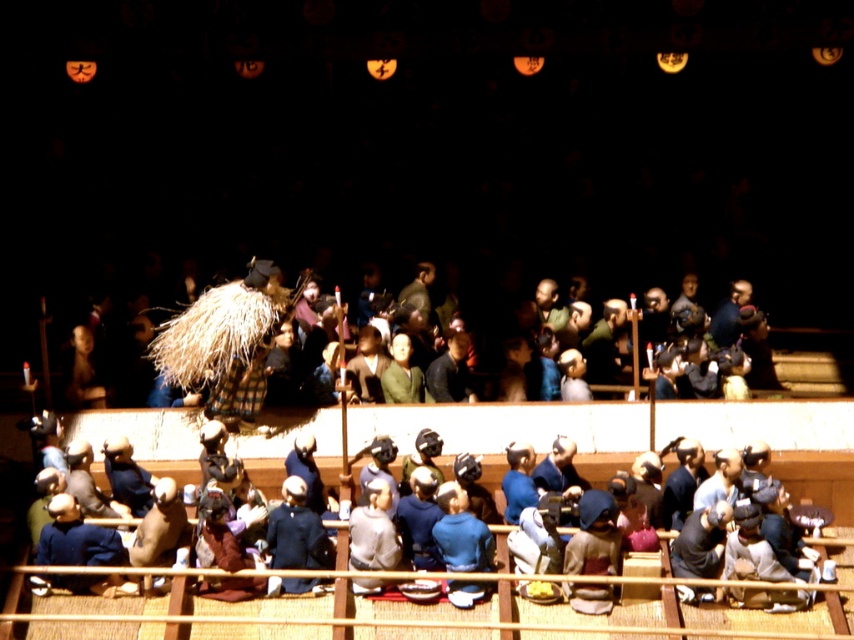
Is dark blue fabric at lower right above dark brown leather jacket at center?

No.

Does dark blue fabric at lower right have a smaller size compared to dark brown leather jacket at center?

Correct, dark blue fabric at lower right occupies less space than dark brown leather jacket at center.

Describe the element at coordinates (700, 541) in the screenshot. Image resolution: width=854 pixels, height=640 pixels. I see `dark blue fabric at lower right` at that location.

Locate an element on the screen. The width and height of the screenshot is (854, 640). dark blue fabric at lower right is located at coordinates (700, 541).

Can you confirm if blue fabric kimono at lower left is bigger than green fabric kimono at center?

No.

Describe the element at coordinates (75, 538) in the screenshot. I see `blue fabric kimono at lower left` at that location.

Is point (69, 561) less distant than point (385, 376)?

Yes, point (69, 561) is in front of point (385, 376).

Where is `blue fabric kimono at lower left`? blue fabric kimono at lower left is located at coordinates (75, 538).

Does point (718, 500) come closer to viewer compared to point (414, 387)?

Yes, it is.

Can you confirm if dark blue fabric at lower right is wider than green fabric kimono at center?

Correct, the width of dark blue fabric at lower right exceeds that of green fabric kimono at center.

Which is in front, point (712, 560) or point (389, 378)?

Point (712, 560)

This screenshot has height=640, width=854. What are the coordinates of `dark blue fabric at lower right` in the screenshot? It's located at (700, 541).